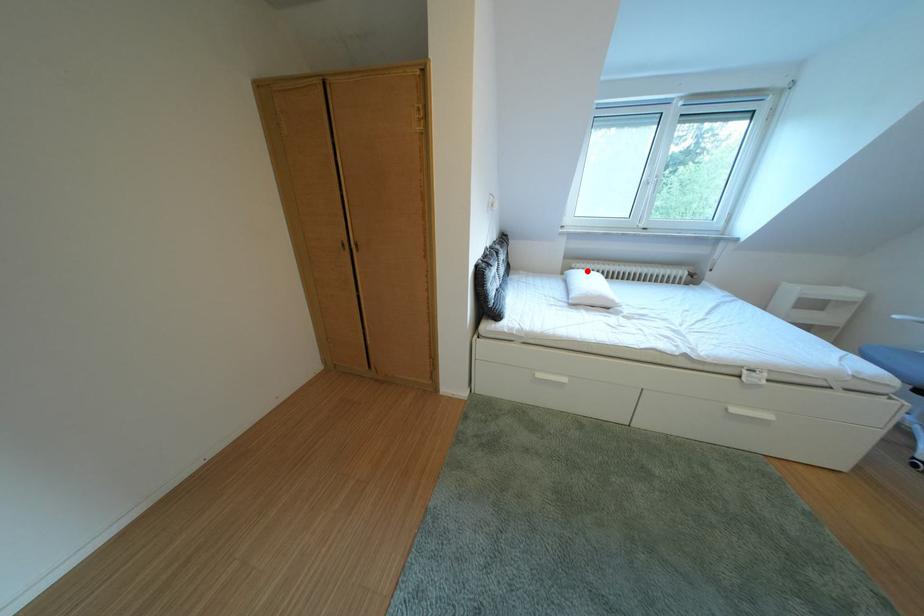
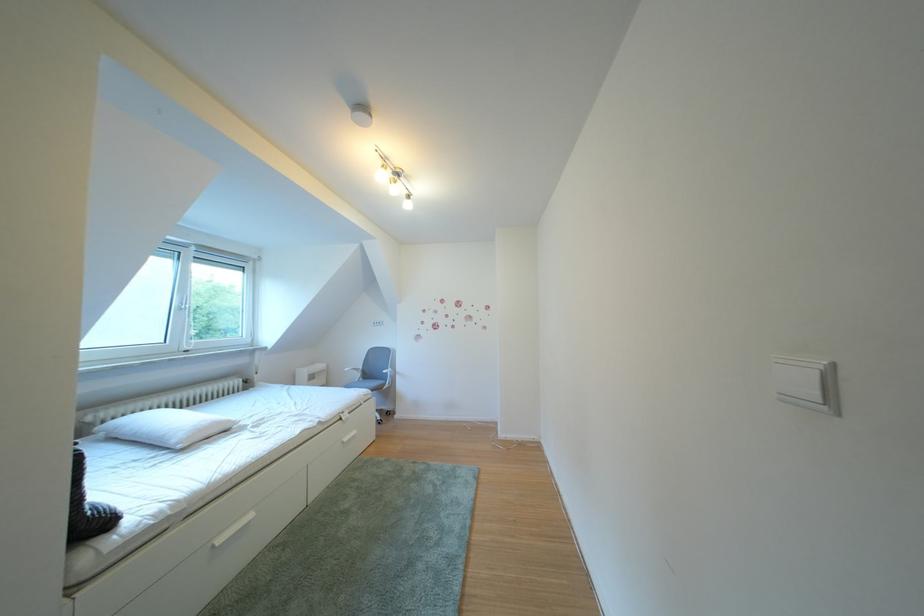
In the second image, find the point that corresponds to the highlighted location in the first image.

(103, 424)